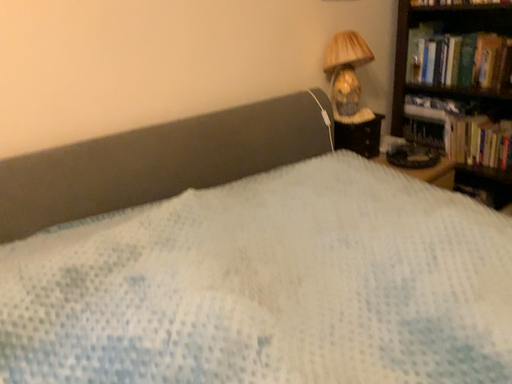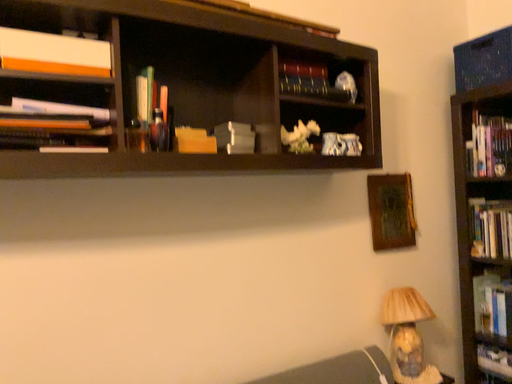
Question: Which way did the camera rotate in the video?

Choices:
 (A) rotated left
 (B) rotated right

Answer: (A)